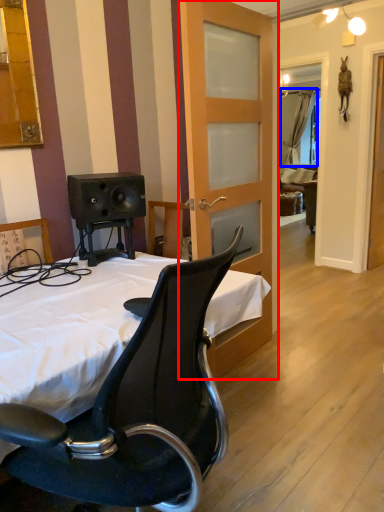
Question: Which object appears farthest to the camera in this image, door (highlighted by a red box) or curtain (highlighted by a blue box)?

Choices:
 (A) door
 (B) curtain

Answer: (B)